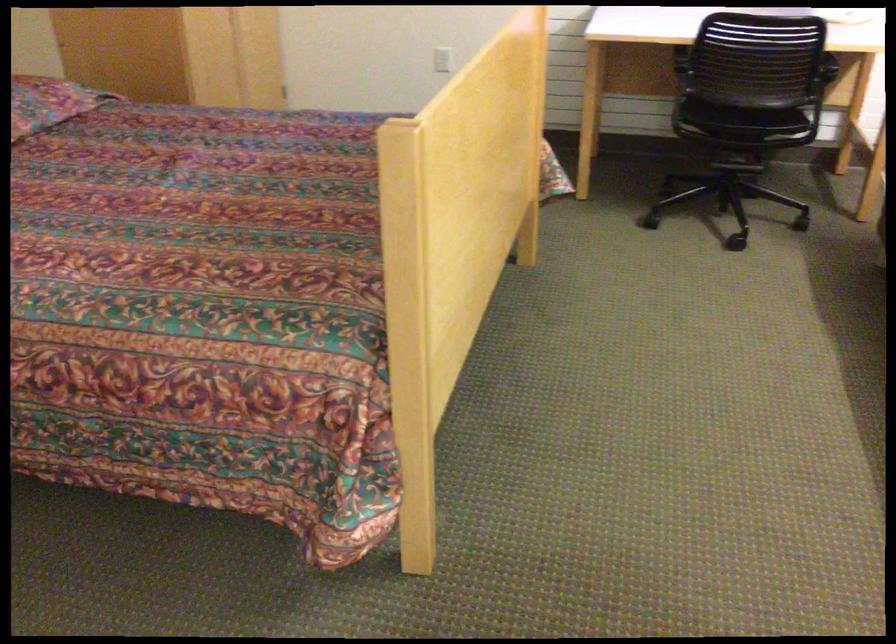
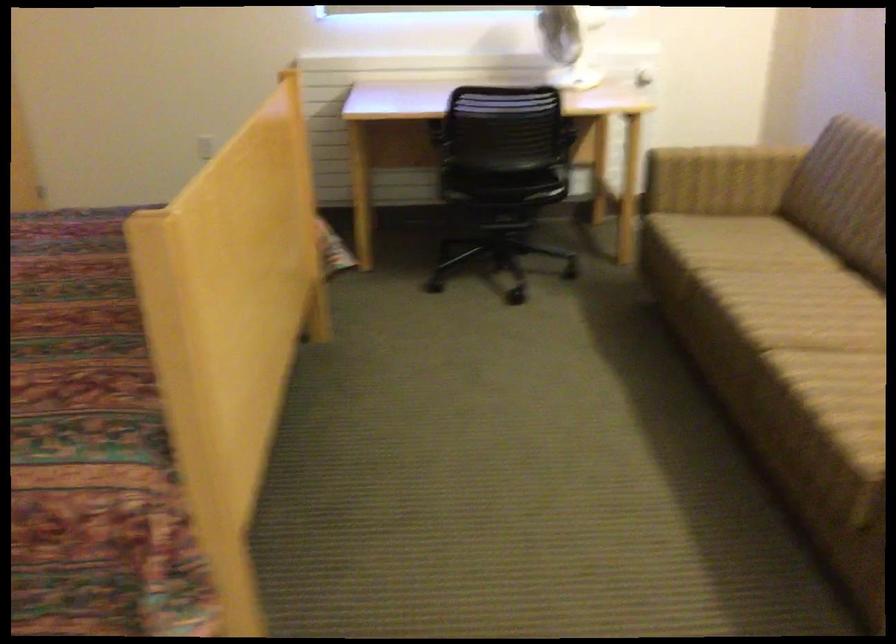
Question: How did the camera likely rotate?

Choices:
 (A) Left
 (B) Right
 (C) Up
 (D) Down

Answer: (B)